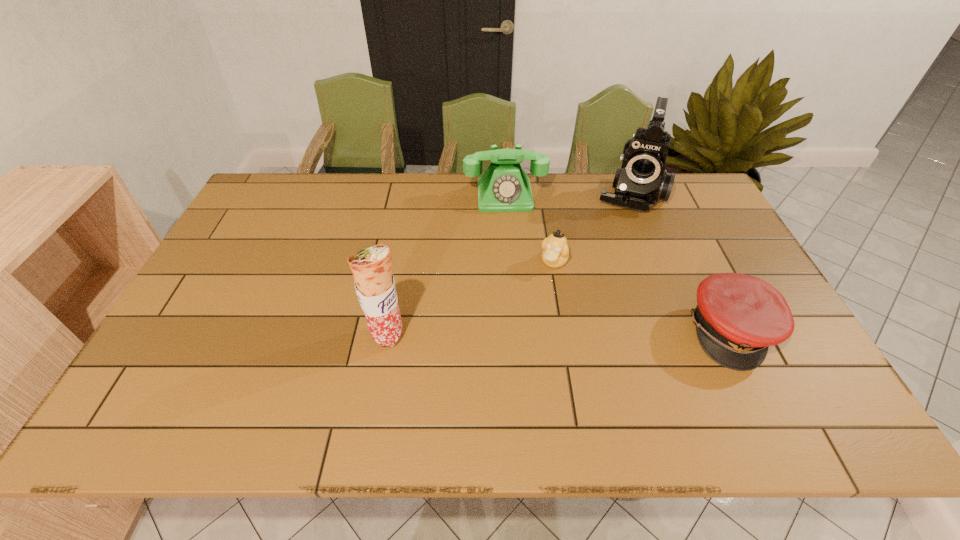
Locate an element on the screen. object present at the far right corner is located at coordinates (642, 180).

In order to click on object at the near right corner in this screenshot , I will do `click(738, 316)`.

The width and height of the screenshot is (960, 540). In the image, there is a desktop. What are the coordinates of `free region at the far edge` in the screenshot? It's located at 540,185.

Locate an element on the screen. The height and width of the screenshot is (540, 960). vacant region at the left edge of the desktop is located at coordinates (207, 276).

Locate an element on the screen. The height and width of the screenshot is (540, 960). vacant space at the right edge of the desktop is located at coordinates (716, 230).

In the image, there is a desktop. Identify the location of vacant space at the far left corner. (292, 180).

Image resolution: width=960 pixels, height=540 pixels. I want to click on vacant space at the far right corner of the desktop, so click(681, 205).

The height and width of the screenshot is (540, 960). In the image, there is a desktop. In order to click on blank space at the near right corner in this screenshot , I will do click(x=788, y=357).

You are a GUI agent. You are given a task and a screenshot of the screen. Output one action in this format:
    pyautogui.click(x=<x>, y=<y>)
    Task: Click on the vacant area that lies between the duckling and the cap
    The height and width of the screenshot is (540, 960).
    Given the screenshot: What is the action you would take?
    pyautogui.click(x=642, y=296)

This screenshot has width=960, height=540. I want to click on vacant area between the telephone and the burrito, so click(x=446, y=266).